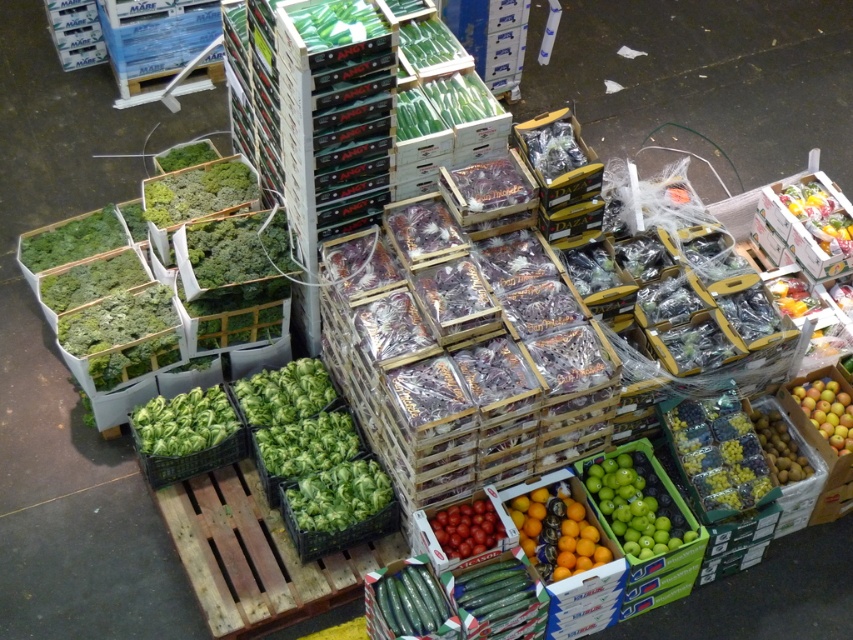
Based on the photo, you are a customer in the market looking at the shiny metallic fruit at upper right and the green matte grapes at lower right. Which one is closer to you?

The shiny metallic fruit at upper right is closer to you because the green matte grapes at lower right is behind it.

You are a delivery person who needs to load a box onto a truck. You have to choose between the green leafy at center and the green matte cucumber at center. Which one should you pick if you want to carry the bigger item?

The green leafy at center is larger in size than the green matte cucumber at center, so you should pick the green leafy at center if you want to carry the bigger item.